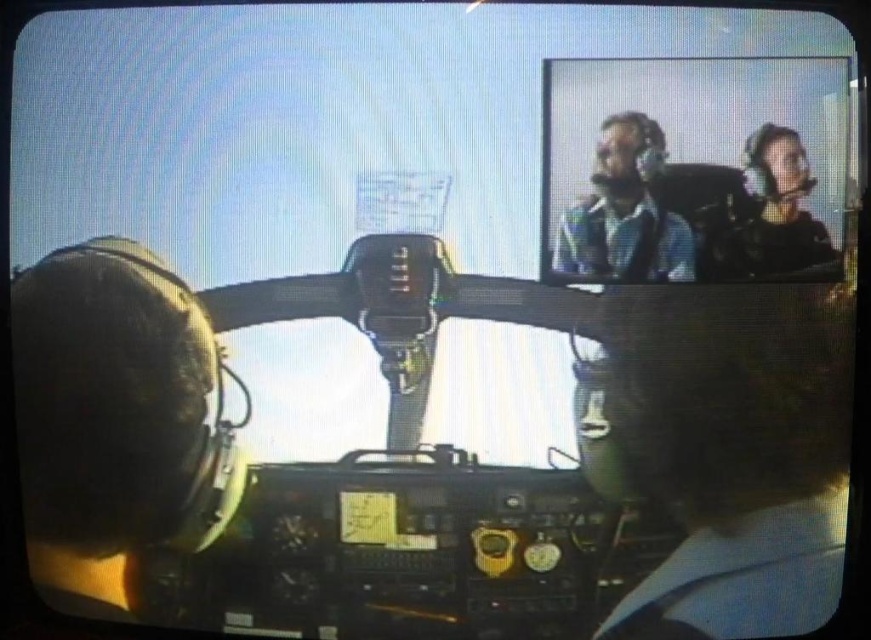
You are a pilot in the cockpit and need to reach for an object. Given that your arm can extend 1 meter, can you comfortably reach both the matte blue shirt at upper right and the matte black helmet at upper right?

The matte blue shirt at upper right is narrower than the matte black helmet at upper right, so you can comfortably reach both as long as they are within your 1 meter arm extension range. However, the exact reachability depends on their distance from your seat, which isn

You are a pilot in the cockpit and need to reach both the matte blue shirt at upper right and the matte black helmet at upper right. If your arm can extend 3 inches, can you grab both items without moving your seat?

The matte blue shirt at upper right is only 3.33 inches from the matte black helmet at upper right. Since your arm can extend 3 inches, you cannot reach both items simultaneously without moving your seat.

You are a pilot in the cockpit and need to adjust your headset. You see the matte blue shirt at upper right and the matte black helmet at upper right. Which object is positioned higher in the cockpit?

The matte blue shirt at upper right is taller than the matte black helmet at upper right, so the matte blue shirt at upper right is positioned higher in the cockpit.